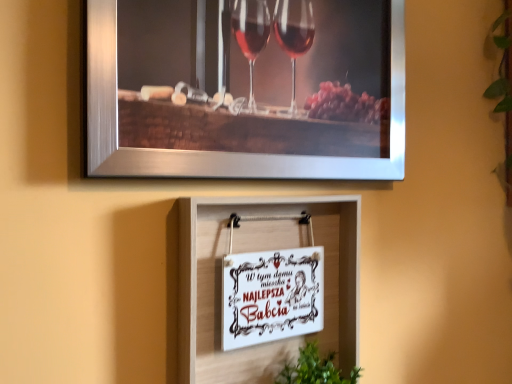
Question: Is the depth of white paper sign at center, which appears as the 2th picture frame when ordered from the bottom, less than that of green leafy plant at lower center?

Choices:
 (A) yes
 (B) no

Answer: (A)

Question: Can you confirm if white paper sign at center, which appears as the 2th picture frame when ordered from the bottom, is smaller than green leafy plant at lower center?

Choices:
 (A) yes
 (B) no

Answer: (A)

Question: From the image's perspective, is white paper sign at center, which appears as the 2th picture frame when ordered from the bottom, over green leafy plant at lower center?

Choices:
 (A) yes
 (B) no

Answer: (A)

Question: Is white paper sign at center, which is the second picture frame from top to bottom, outside of green leafy plant at lower center?

Choices:
 (A) no
 (B) yes

Answer: (B)

Question: Could you tell me if white paper sign at center, which is the second picture frame from top to bottom, is facing green leafy plant at lower center?

Choices:
 (A) no
 (B) yes

Answer: (A)

Question: From the image's perspective, is green leafy plant at lower center above or below white paper sign at center, the 1th picture frame in the bottom-to-top sequence?

Choices:
 (A) above
 (B) below

Answer: (B)

Question: Looking at the image, does green leafy plant at lower center seem bigger or smaller compared to white paper sign at center, the 1th picture frame in the bottom-to-top sequence?

Choices:
 (A) small
 (B) big

Answer: (A)

Question: From a real-world perspective, relative to white paper sign at center, the 1th picture frame in the bottom-to-top sequence, is green leafy plant at lower center vertically above or below?

Choices:
 (A) above
 (B) below

Answer: (B)

Question: Considering the positions of point (362, 369) and point (333, 271), is point (362, 369) closer or farther from the camera than point (333, 271)?

Choices:
 (A) closer
 (B) farther

Answer: (B)

Question: In the image, is green leafy plant at lower center on the left side or the right side of white paper sign at center, which is the second picture frame from top to bottom?

Choices:
 (A) right
 (B) left

Answer: (A)

Question: Do you think green leafy plant at lower center is within white paper sign at center, which appears as the 2th picture frame when ordered from the bottom, or outside of it?

Choices:
 (A) inside
 (B) outside

Answer: (B)

Question: From a real-world perspective, relative to white paper sign at center, which is the second picture frame from top to bottom, is green leafy plant at lower center vertically above or below?

Choices:
 (A) above
 (B) below

Answer: (B)

Question: In terms of width, does green leafy plant at lower center look wider or thinner when compared to white paper sign at center, which appears as the 2th picture frame when ordered from the bottom?

Choices:
 (A) thin
 (B) wide

Answer: (B)

Question: Looking at their shapes, would you say metallic silver picture frame at upper center, the 1th picture frame viewed from the top, is wider or thinner than white paper sign at center, which appears as the 2th picture frame when ordered from the bottom?

Choices:
 (A) thin
 (B) wide

Answer: (B)

Question: Considering their positions, is metallic silver picture frame at upper center, positioned as the third picture frame in bottom-to-top order, located in front of or behind white paper sign at center, which appears as the 2th picture frame when ordered from the bottom?

Choices:
 (A) behind
 (B) front

Answer: (B)